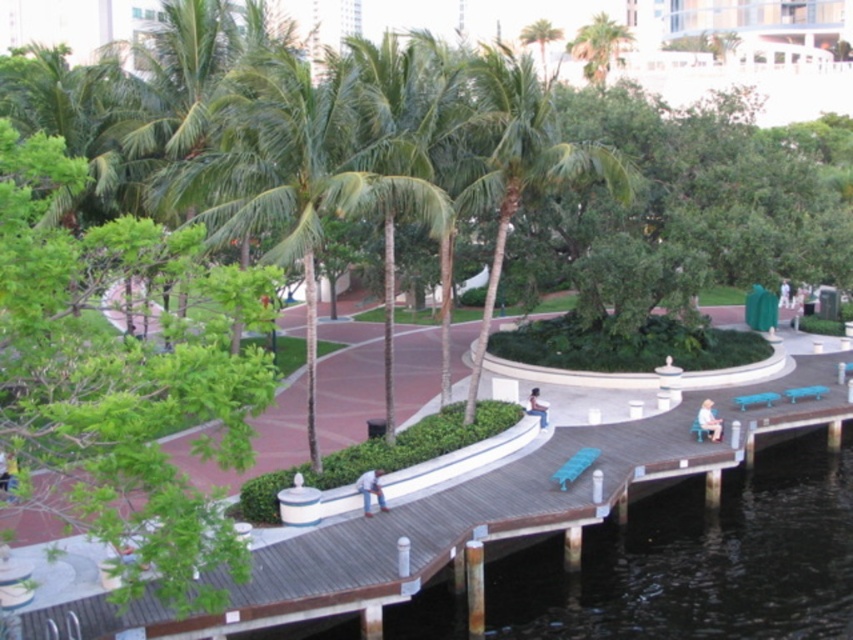
Where is `green leafy palm tree at upper center`? Image resolution: width=853 pixels, height=640 pixels. green leafy palm tree at upper center is located at coordinates [599, 48].

Does point (587, 28) come closer to viewer compared to point (3, 458)?

That is False.

The width and height of the screenshot is (853, 640). Identify the location of green leafy palm tree at upper center. (599, 48).

At what (x,y) coordinates should I click in order to perform the action: click on green leafy palm tree at upper center. Please return your answer as a coordinate pair (x, y). The height and width of the screenshot is (640, 853). Looking at the image, I should click on (599, 48).

Is green leafy palm tree at upper center thinner than light beige fabric chair at lower right?

No, green leafy palm tree at upper center is not thinner than light beige fabric chair at lower right.

From the picture: Who is positioned more to the right, green leafy palm tree at upper center or light beige fabric chair at lower right?

green leafy palm tree at upper center

Between point (630, 35) and point (712, 422), which one is positioned behind?

The point (630, 35) is behind.

Where is `green leafy palm tree at upper center`? green leafy palm tree at upper center is located at coordinates (599, 48).

Which is in front, point (572, 36) or point (369, 477)?

Point (369, 477) is in front.

Find the location of `green leafy palm tree at upper center`. green leafy palm tree at upper center is located at coordinates (599, 48).

Is point (602, 36) positioned behind point (381, 472)?

That is True.

You are a GUI agent. You are given a task and a screenshot of the screen. Output one action in this format:
    pyautogui.click(x=<x>, y=<y>)
    Task: Click on the green leafy palm tree at upper center
    
    Given the screenshot: What is the action you would take?
    pyautogui.click(x=599, y=48)